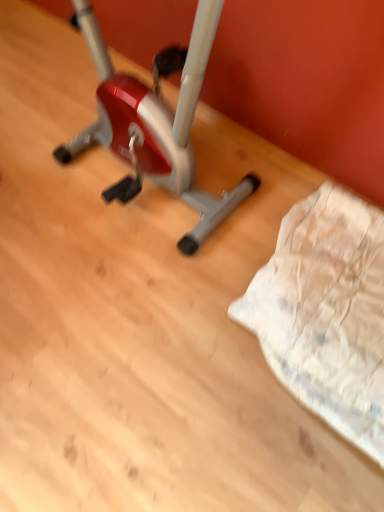
Question: Is point (221, 203) closer or farther from the camera than point (375, 233)?

Choices:
 (A) closer
 (B) farther

Answer: (B)

Question: Which is correct: metallic silver stationary bicycle at center is inside white textured fabric at lower right, or outside of it?

Choices:
 (A) outside
 (B) inside

Answer: (A)

Question: Is metallic silver stationary bicycle at center wider or thinner than white textured fabric at lower right?

Choices:
 (A) wide
 (B) thin

Answer: (B)

Question: Is point (365, 373) positioned closer to the camera than point (124, 102)?

Choices:
 (A) closer
 (B) farther

Answer: (A)

Question: Is white textured fabric at lower right taller or shorter than metallic silver stationary bicycle at center?

Choices:
 (A) tall
 (B) short

Answer: (B)

Question: From a real-world perspective, is white textured fabric at lower right physically located above or below metallic silver stationary bicycle at center?

Choices:
 (A) above
 (B) below

Answer: (B)

Question: Considering the positions of white textured fabric at lower right and metallic silver stationary bicycle at center in the image, is white textured fabric at lower right bigger or smaller than metallic silver stationary bicycle at center?

Choices:
 (A) small
 (B) big

Answer: (A)